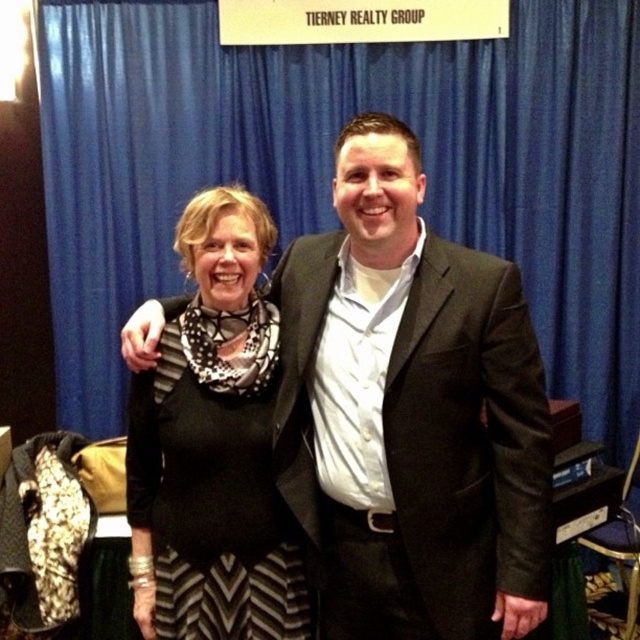
What object is located at the coordinates point (x=332, y=168) in the image?

The point (x=332, y=168) corresponds to the blue fabric curtain at upper center.

Based on the photo, you are standing at the entrance of the event venue and want to take a photo of the point at coordinates point (193, 112). If your camera can focus on objects within 3 meters, will you be able to capture that point clearly?

The distance of point (193, 112) from viewer is 2.99 meters, so yes, the camera can focus on it clearly since it is within the 3 meters range.

You are organizing a charity event and need to decide which item to place on a small donation table. The table can only accommodate items that are smaller than a certain size. Given the scene, which item between the black matte suit at center and the black dotted scarf at center is more likely to fit on the table?

The black dotted scarf at center is smaller than the black matte suit at center, so it is more likely to fit on the small donation table.